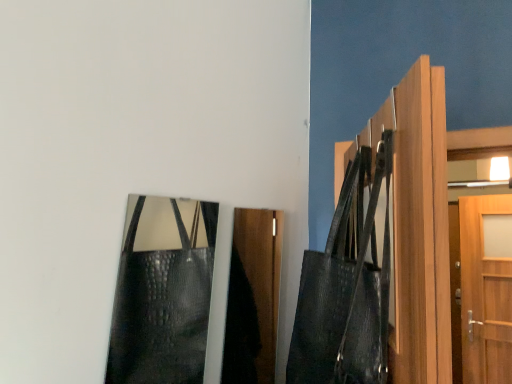
Question: Should I look upward or downward to see leather textured shoulder bag at upper right?

Choices:
 (A) up
 (B) down

Answer: (B)

Question: Considering the relative sizes of shiny black leather bag at lower left and light brown wood door at right in the image provided, is shiny black leather bag at lower left wider than light brown wood door at right?

Choices:
 (A) yes
 (B) no

Answer: (B)

Question: Is shiny black leather bag at lower left directly adjacent to light brown wood door at right?

Choices:
 (A) yes
 (B) no

Answer: (B)

Question: Is shiny black leather bag at lower left looking in the opposite direction of light brown wood door at right?

Choices:
 (A) no
 (B) yes

Answer: (A)

Question: Is the position of shiny black leather bag at lower left less distant than that of light brown wood door at right?

Choices:
 (A) yes
 (B) no

Answer: (B)

Question: Considering the relative sizes of shiny black leather bag at lower left and light brown wood door at right in the image provided, is shiny black leather bag at lower left shorter than light brown wood door at right?

Choices:
 (A) yes
 (B) no

Answer: (A)

Question: Is shiny black leather bag at lower left thinner than light brown wood door at right?

Choices:
 (A) no
 (B) yes

Answer: (B)

Question: From the image's perspective, is light brown wood door at right located above shiny black leather bag at lower left?

Choices:
 (A) no
 (B) yes

Answer: (B)

Question: Considering the relative sizes of light brown wood door at right and shiny black leather bag at lower left in the image provided, is light brown wood door at right shorter than shiny black leather bag at lower left?

Choices:
 (A) yes
 (B) no

Answer: (B)

Question: Is light brown wood door at right at the right side of shiny black leather bag at lower left?

Choices:
 (A) no
 (B) yes

Answer: (B)

Question: Considering the relative positions of light brown wood door at right and shiny black leather bag at lower left in the image provided, is light brown wood door at right to the left of shiny black leather bag at lower left from the viewer's perspective?

Choices:
 (A) yes
 (B) no

Answer: (B)

Question: From a real-world perspective, does light brown wood door at right sit lower than shiny black leather bag at lower left?

Choices:
 (A) no
 (B) yes

Answer: (A)

Question: Is shiny black leather bag at lower left located within light brown wood door at right?

Choices:
 (A) yes
 (B) no

Answer: (B)

Question: Are leather textured shoulder bag at upper right and shiny black leather bag at lower left far apart?

Choices:
 (A) no
 (B) yes

Answer: (A)